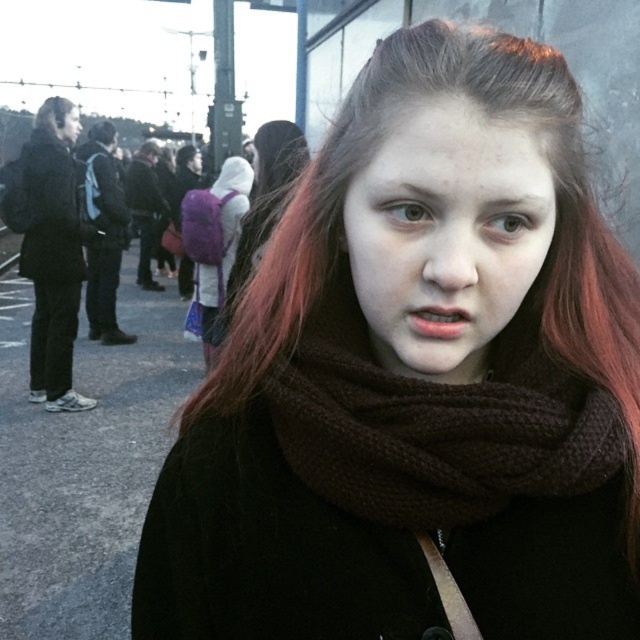
Can you confirm if matte black jacket at left is wider than brown woolen hair at upper left?

Yes, matte black jacket at left is wider than brown woolen hair at upper left.

At what (x,y) coordinates should I click in order to perform the action: click on matte black jacket at left. Please return your answer as a coordinate pair (x, y). Looking at the image, I should click on (49, 248).

What are the coordinates of `matte black jacket at left` in the screenshot? It's located at (49, 248).

Which is in front, point (428, 508) or point (45, 236)?

Point (428, 508)

Can you confirm if brown knitted scarf at center is positioned to the left of matte black jacket at left?

Incorrect, brown knitted scarf at center is not on the left side of matte black jacket at left.

Which is in front, point (518, 472) or point (44, 104)?

Point (518, 472) is more forward.

Locate an element on the screen. brown knitted scarf at center is located at coordinates (438, 422).

Who is higher up, matte black backpack at left or brown woolen hair at upper left?

Positioned higher is brown woolen hair at upper left.

Is the position of matte black backpack at left less distant than that of brown woolen hair at upper left?

No, it is not.

Identify the location of matte black backpack at left. (104, 234).